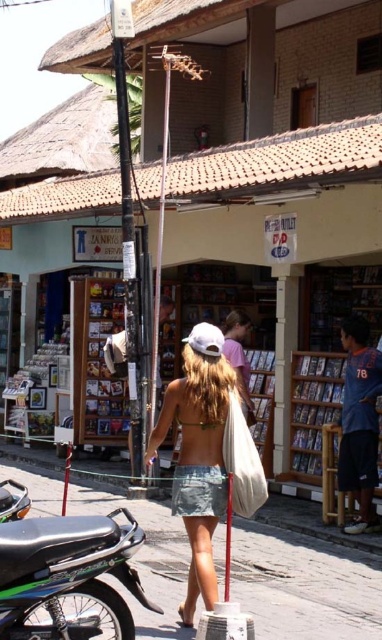
Is smooth concrete pavement at center positioned before denim skirt at center?

No, it is behind denim skirt at center.

Find the location of a particular element. smooth concrete pavement at center is located at coordinates (304, 584).

Does point (145, 630) come closer to viewer compared to point (218, 442)?

Yes, it is in front of point (218, 442).

Where is `smooth concrete pavement at center`? This screenshot has height=640, width=382. smooth concrete pavement at center is located at coordinates tap(304, 584).

Does smooth concrete pavement at center have a smaller size compared to shiny black motorcycle at lower left?

Indeed, smooth concrete pavement at center has a smaller size compared to shiny black motorcycle at lower left.

Is point (304, 561) farther from viewer compared to point (11, 509)?

Yes, point (304, 561) is farther from viewer.

Identify the location of smooth concrete pavement at center. This screenshot has height=640, width=382. (304, 584).

Measure the distance between point (352, 520) and camera.

Point (352, 520) is 25.47 feet away from camera.

Locate an element on the screen. blue fabric shirt at center is located at coordinates (359, 422).

What do you see at coordinates (359, 422) in the screenshot?
I see `blue fabric shirt at center` at bounding box center [359, 422].

Locate an element on the screen. blue fabric shirt at center is located at coordinates (359, 422).